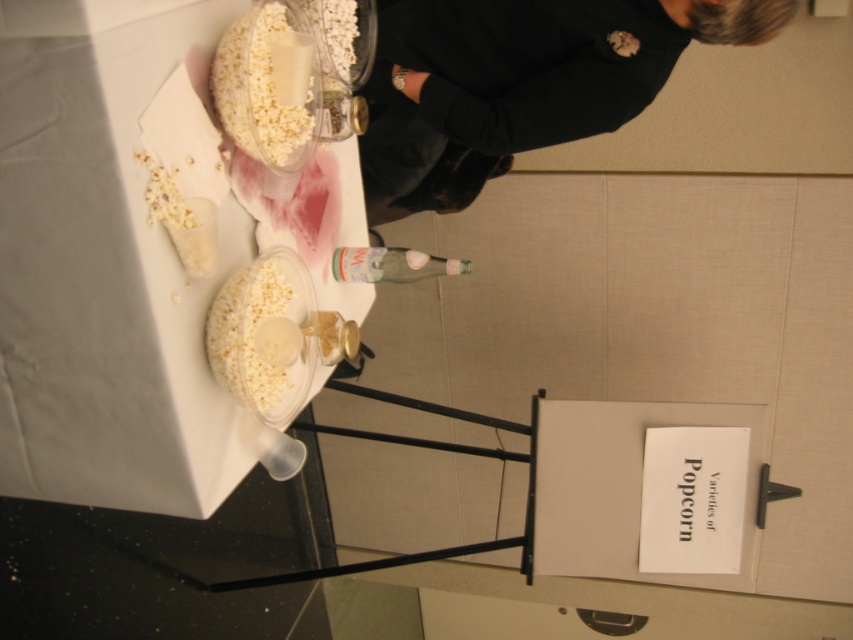
Question: Which object is positioned farthest from the black fabric at upper right?

Choices:
 (A) white fluffy popcorn at upper center
 (B) white fluffy popcorn at center

Answer: (B)

Question: Estimate the real-world distances between objects in this image. Which object is closer to the white fluffy popcorn at upper center?

Choices:
 (A) white fluffy popcorn at center
 (B) black fabric at upper right

Answer: (A)

Question: Can you confirm if black fabric at upper right is bigger than white fluffy popcorn at center?

Choices:
 (A) no
 (B) yes

Answer: (B)

Question: Is black fabric at upper right smaller than white fluffy popcorn at upper center?

Choices:
 (A) yes
 (B) no

Answer: (B)

Question: Which object is closer to the camera taking this photo?

Choices:
 (A) white fluffy popcorn at upper center
 (B) white fluffy popcorn at center

Answer: (A)

Question: Is black fabric at upper right above white fluffy popcorn at upper center?

Choices:
 (A) no
 (B) yes

Answer: (B)